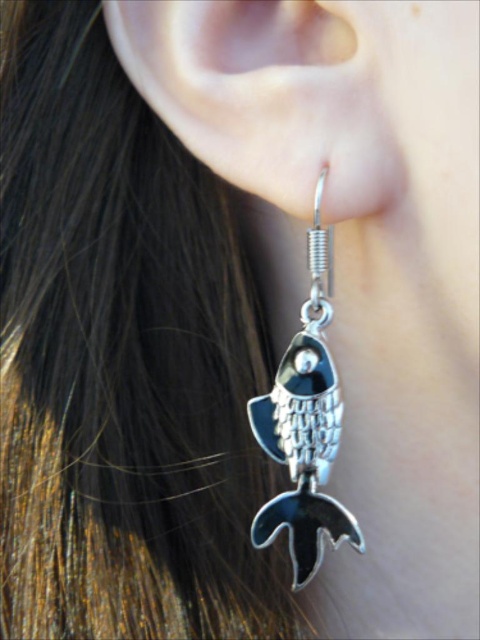
In the scene shown: How far apart are silver metallic earring at center and silver metallic fish at lower left?

4.74 inches

Can you confirm if silver metallic earring at center is positioned above silver metallic fish at lower left?

Yes.

Does point (262, 68) come in front of point (300, 417)?

Yes, it is in front of point (300, 417).

You are a GUI agent. You are given a task and a screenshot of the screen. Output one action in this format:
    pyautogui.click(x=<x>, y=<y>)
    Task: Click on the silver metallic earring at center
    The height and width of the screenshot is (640, 480).
    Given the screenshot: What is the action you would take?
    pyautogui.click(x=265, y=99)